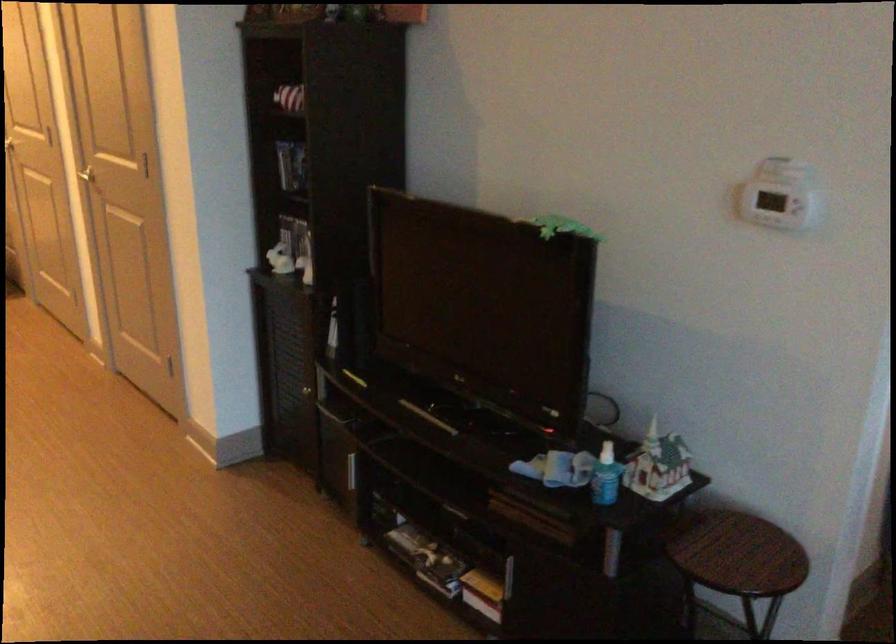
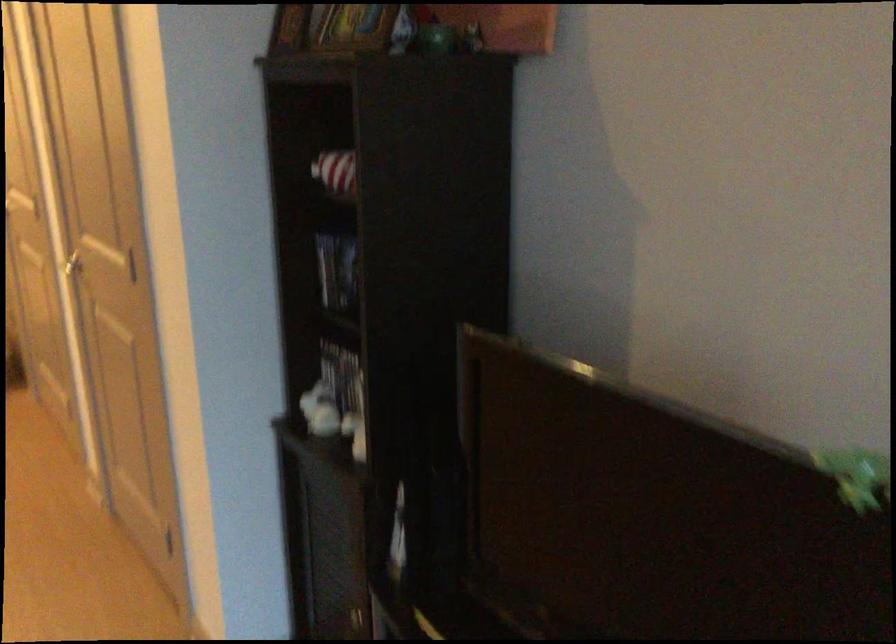
The point at (x=547, y=223) is marked in the first image. Where is the corresponding point in the second image?

(857, 476)